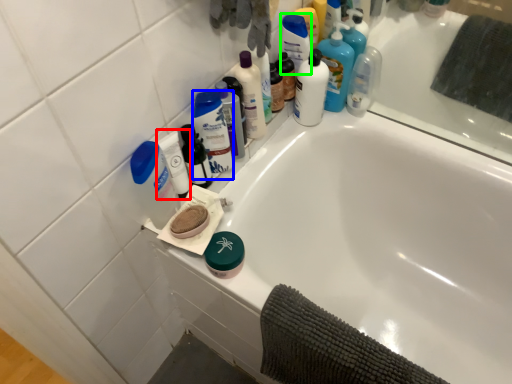
Question: Which object is positioned closest to mouthwash (highlighted by a red box)? Select from cleaning product (highlighted by a blue box) and cleaning product (highlighted by a green box).

Choices:
 (A) cleaning product
 (B) cleaning product

Answer: (A)